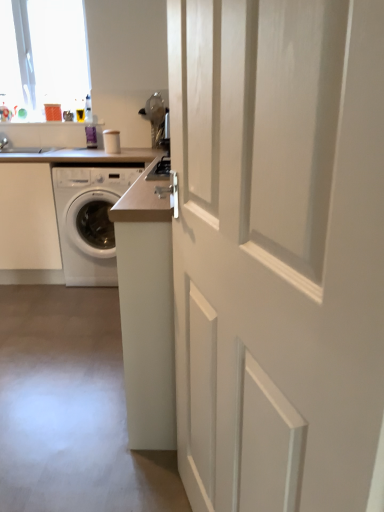
Question: Should I look upward or downward to see white glossy washing machine at left?

Choices:
 (A) down
 (B) up

Answer: (B)

Question: Is white glossy door at center outside of white glossy washing machine at left?

Choices:
 (A) yes
 (B) no

Answer: (A)

Question: Is white glossy door at center taller than white glossy washing machine at left?

Choices:
 (A) yes
 (B) no

Answer: (A)

Question: Does white glossy door at center lie in front of white glossy washing machine at left?

Choices:
 (A) yes
 (B) no

Answer: (A)

Question: Is white glossy door at center positioned with its back to white glossy washing machine at left?

Choices:
 (A) no
 (B) yes

Answer: (A)

Question: Can you confirm if white glossy door at center is shorter than white glossy washing machine at left?

Choices:
 (A) no
 (B) yes

Answer: (A)

Question: Does white glossy door at center have a greater width compared to white glossy washing machine at left?

Choices:
 (A) yes
 (B) no

Answer: (B)

Question: Is white glossy door at center at the back of white glossy washing machine at left?

Choices:
 (A) yes
 (B) no

Answer: (B)

Question: Does white glossy washing machine at left have a larger size compared to white glossy door at center?

Choices:
 (A) yes
 (B) no

Answer: (A)

Question: Can you confirm if white glossy washing machine at left is positioned to the right of white glossy door at center?

Choices:
 (A) yes
 (B) no

Answer: (B)

Question: Is white glossy washing machine at left smaller than white glossy door at center?

Choices:
 (A) yes
 (B) no

Answer: (B)

Question: Does white glossy washing machine at left have a greater height compared to white glossy door at center?

Choices:
 (A) no
 (B) yes

Answer: (A)

Question: Could white glossy door at center be considered to be inside white glossy washing machine at left?

Choices:
 (A) yes
 (B) no

Answer: (B)

Question: Can you confirm if white glossy door at center is bigger than white laminate counter at center?

Choices:
 (A) yes
 (B) no

Answer: (B)